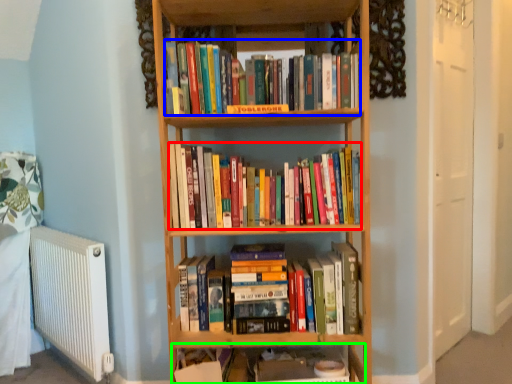
Question: Considering the real-world distances, which object is farthest from book (highlighted by a red box)? book (highlighted by a blue box) or shelf (highlighted by a green box)?

Choices:
 (A) book
 (B) shelf

Answer: (B)